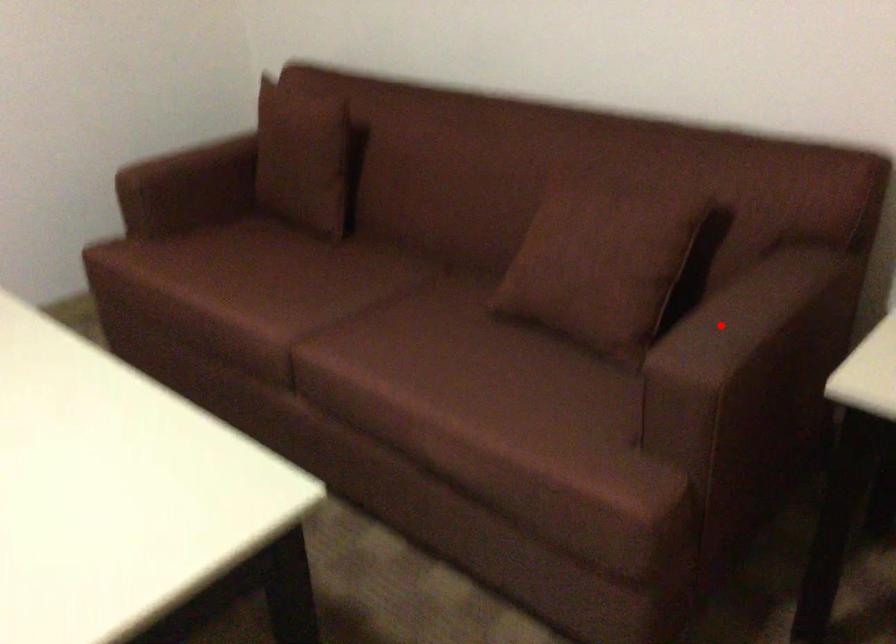
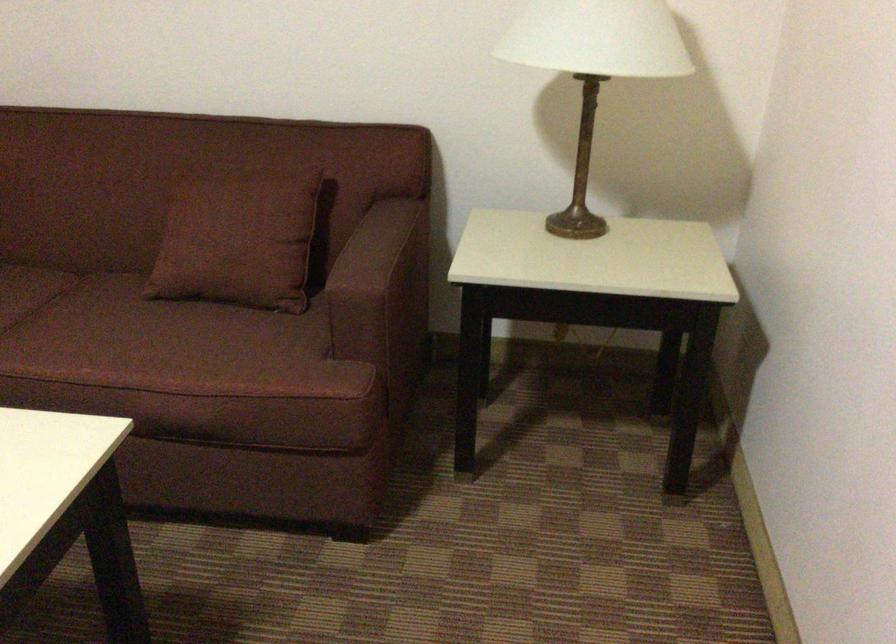
Question: I am providing you with two images of the same scene from different viewpoints. Image1 has a red point marked. In image2, the corresponding 3D location appears at what relative position? Reply with the corresponding letter.

Choices:
 (A) Closer
 (B) Farther

Answer: (B)